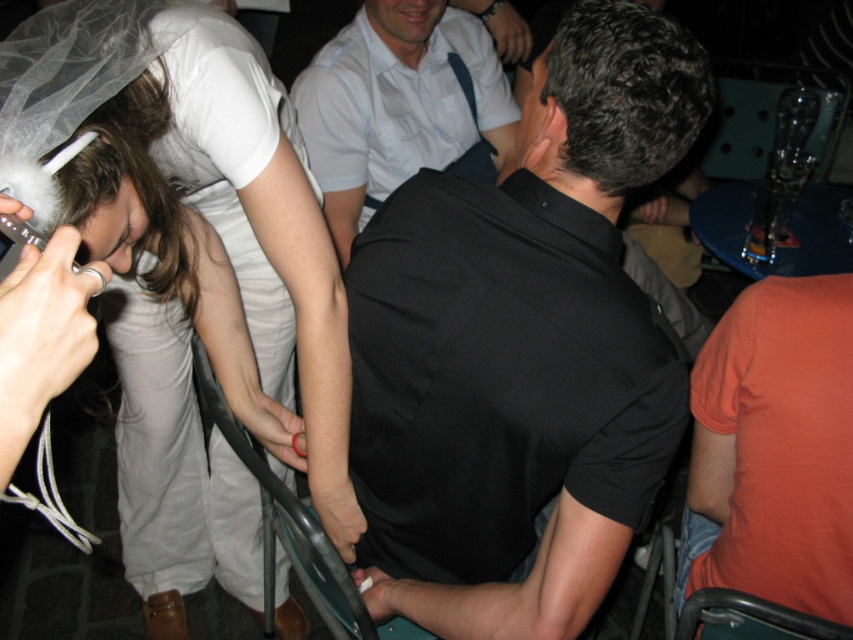
Question: Can you confirm if orange cotton shirt at right is wider than white shirt at center?

Choices:
 (A) no
 (B) yes

Answer: (A)

Question: Is black smooth shirt at center closer to camera compared to white shirt at center?

Choices:
 (A) yes
 (B) no

Answer: (A)

Question: Which point appears farthest from the camera in this image?

Choices:
 (A) (734, 461)
 (B) (370, 120)

Answer: (B)

Question: Considering the relative positions of white matte dress at upper left and orange cotton shirt at right in the image provided, where is white matte dress at upper left located with respect to orange cotton shirt at right?

Choices:
 (A) above
 (B) below

Answer: (A)

Question: Which point appears farthest from the camera in this image?

Choices:
 (A) (483, 625)
 (B) (140, 273)
 (C) (410, 168)
 (D) (846, 541)

Answer: (C)

Question: Which of the following is the closest to the observer?

Choices:
 (A) (198, 516)
 (B) (704, 451)

Answer: (B)